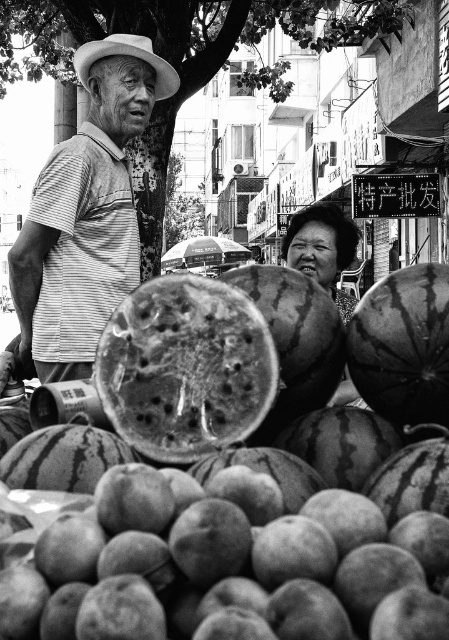
You are a customer at the market looking to buy a watermelon. You see the ripe green watermelon at center and the smooth dark green watermelon at center. Which one is placed above the other?

The smooth dark green watermelon at center is placed above the ripe green watermelon at center because the ripe green watermelon at center is positioned under it.

You are a customer at the market and want to buy fruits. You see the smooth brown peaches at lower center and the ripe green watermelon at center. Which fruit is bigger in size?

The smooth brown peaches at lower center has a larger size compared to the ripe green watermelon at center.